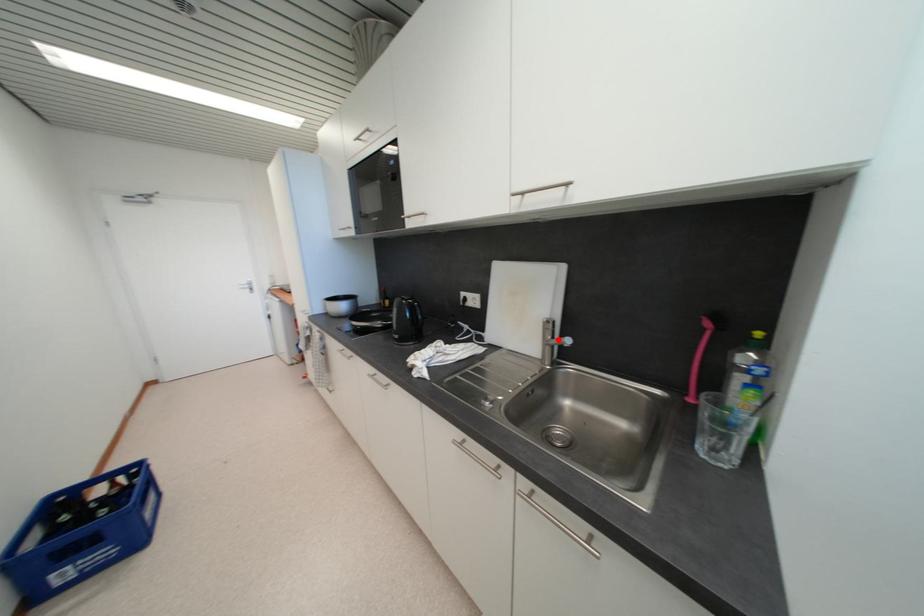
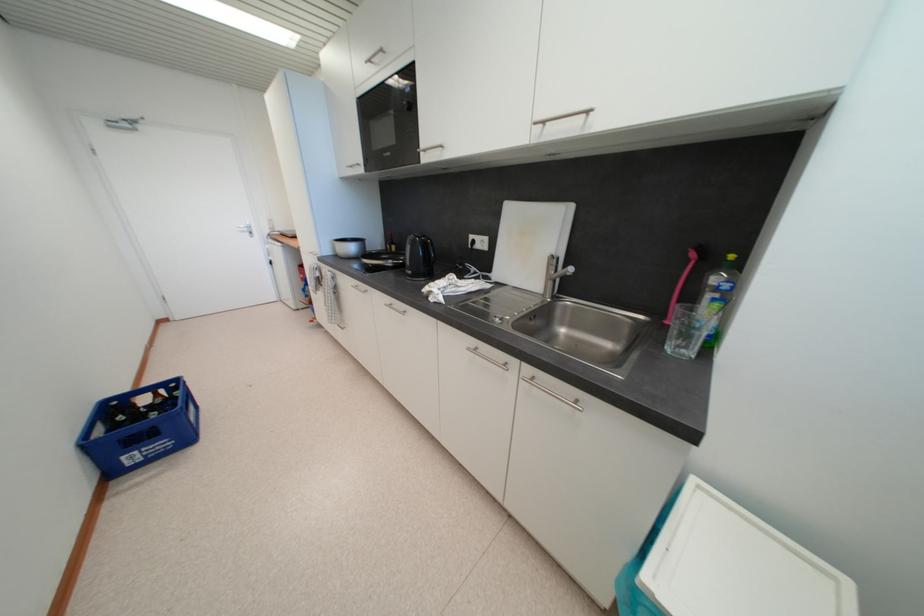
Locate, in the second image, the point that corresponds to the highlighted location in the first image.

(561, 275)